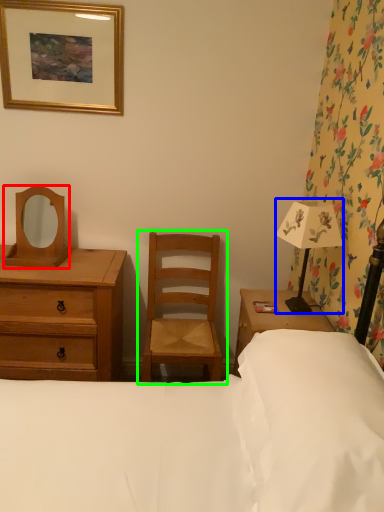
Question: Which object is positioned farthest from mirror (highlighted by a red box)? Select from bedside lamp (highlighted by a blue box) and chair (highlighted by a green box).

Choices:
 (A) bedside lamp
 (B) chair

Answer: (A)